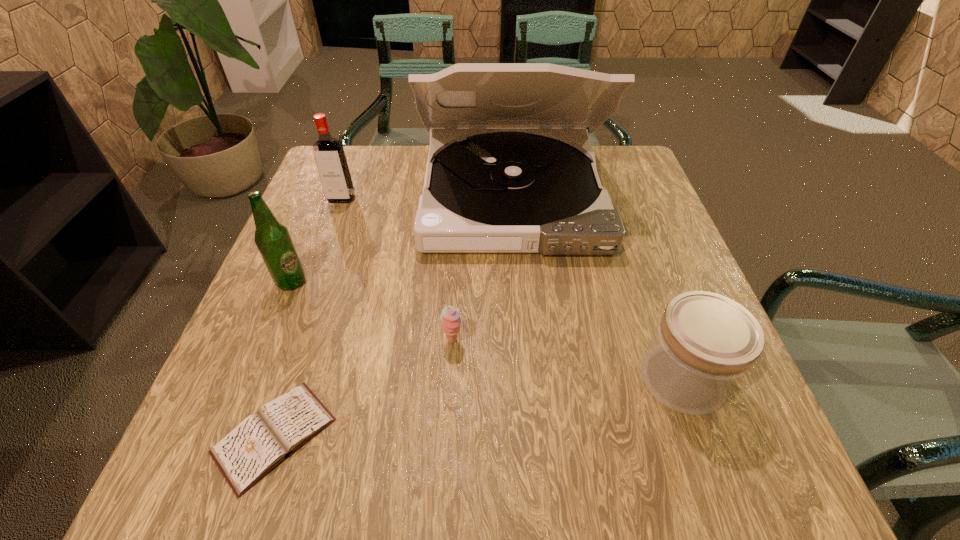
You are a GUI agent. You are given a task and a screenshot of the screen. Output one action in this format:
    pyautogui.click(x=<x>, y=<y>)
    Task: Click on the free space between the shortest object and the fifth tallest object
    
    Given the screenshot: What is the action you would take?
    pyautogui.click(x=363, y=388)

Where is `free point between the shortest object and the beer bottle`? This screenshot has height=540, width=960. free point between the shortest object and the beer bottle is located at coordinates (283, 359).

Identify the location of empty location between the second shortest object and the CD player. The height and width of the screenshot is (540, 960). (482, 268).

The height and width of the screenshot is (540, 960). In order to click on empty space between the diary and the fifth tallest object in this screenshot , I will do `click(363, 388)`.

This screenshot has width=960, height=540. I want to click on free space between the third shortest object and the shortest object, so click(x=478, y=407).

Find the location of a particular element. This screenshot has width=960, height=540. vacant space in between the fourth tallest object and the vodka is located at coordinates (512, 289).

Where is `empty space between the jar and the CD player`? empty space between the jar and the CD player is located at coordinates (597, 287).

Where is `unoccupied position between the sherbert and the CD player`? This screenshot has width=960, height=540. unoccupied position between the sherbert and the CD player is located at coordinates (482, 268).

This screenshot has height=540, width=960. In order to click on the fourth closest object relative to the CD player in this screenshot , I will do `click(705, 343)`.

Identify the location of the fifth closest object relative to the beer bottle. (705, 343).